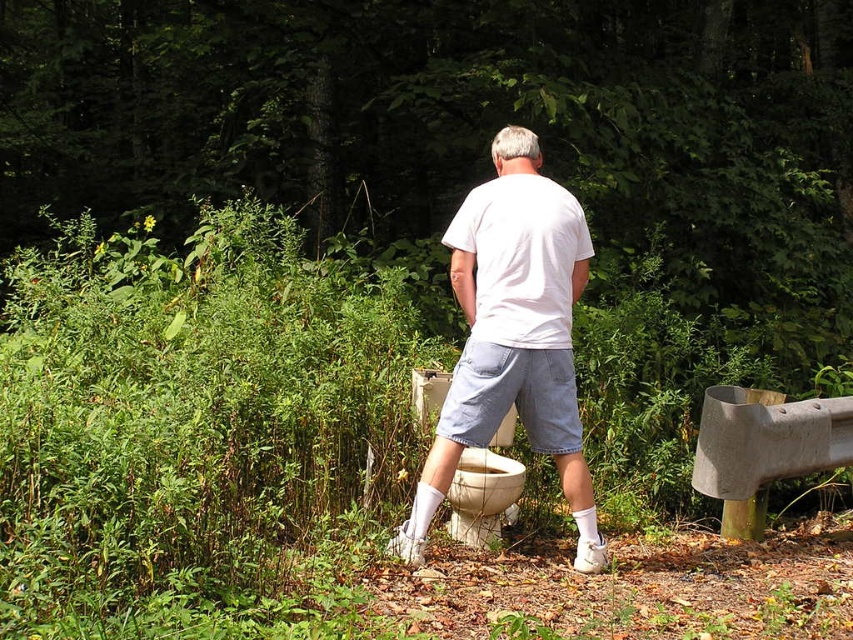
You are a hiker who needs to cross a stream. You see a white cotton shirt at center and concrete at right. Which object is closer to your left side?

The white cotton shirt at center is to the left of concrete at right, so the white cotton shirt at center is closer to your left side.

In the scene shown: You are a photographer capturing the scene described. You notice a point marked at coordinates (x=514, y=336) in the image. Which object in the scene is located at that point?

The point at coordinates (x=514, y=336) corresponds to the white cotton shirt at center.

You are a hiker carrying a backpack and need to place your backpack on the ground near the white cotton shirt at center without it touching the concrete at right. Can you safely place it there if your backpack requires at least 0.5 meters of space from the concrete?

The distance between the white cotton shirt at center and the concrete at right is 1.01 meters. Since the backpack needs at least 0.5 meters of space from the concrete, placing it near the white cotton shirt at center would leave enough space as 1.01 meters is greater than 0.5 meters. Therefore, it is safe to place the backpack there.